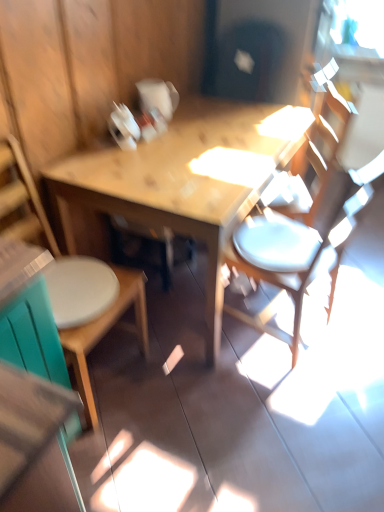
The width and height of the screenshot is (384, 512). I want to click on free space that is in between wooden chair at left, which is counted as the first chair, starting from the left, and wooden table at center, so click(153, 384).